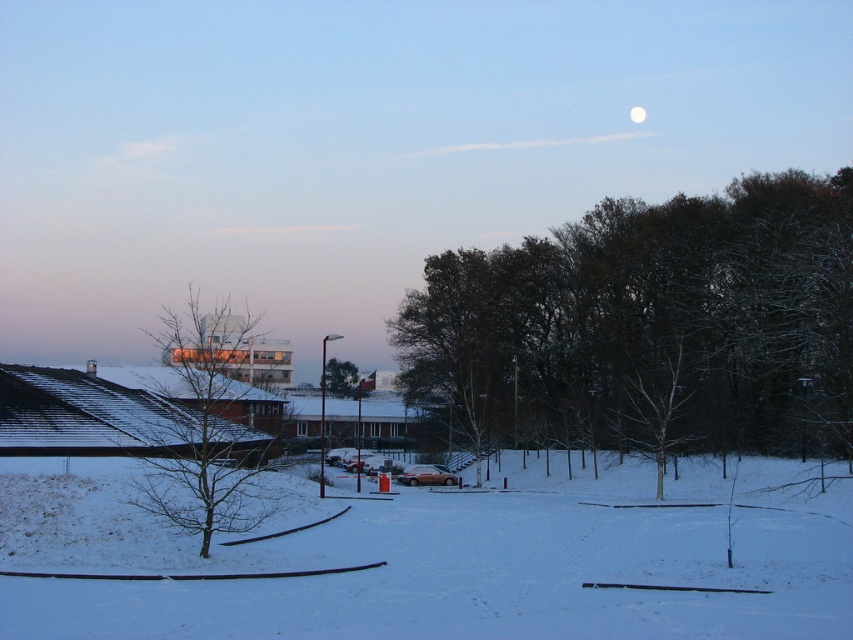
You are standing in the winter scene and want to take a photo of the dark brown textured tree at center and the white powdery snow at center. Which object should you focus on first if you want both to be in sharp focus?

The dark brown textured tree at center is larger than the white powdery snow at center, so focusing on the tree first would ensure both are in sharp focus as the snow is smaller and closer to the camera.

You are standing at the snow covered open area in the winter scene. You see two points marked as point 1 at coordinates point (614,227) and point 2 at coordinates point (224,429). Which point is closer to you?

Point (614,227) is further to the camera than point (224,429), so point (224,429) is closer to you.